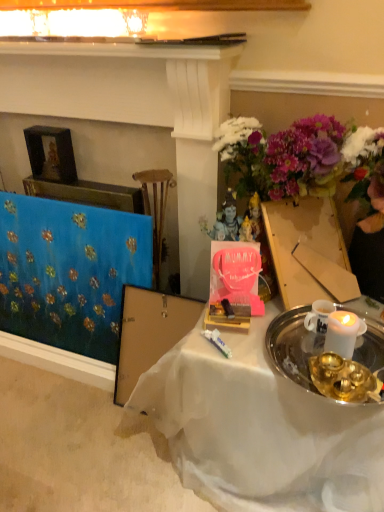
Question: Is blue fabric at left in front of or behind white sheer cloth at center in the image?

Choices:
 (A) behind
 (B) front

Answer: (A)

Question: Visually, is blue fabric at left positioned to the left or to the right of white sheer cloth at center?

Choices:
 (A) right
 (B) left

Answer: (B)

Question: Which of these objects is positioned closest to the blue fabric at left?

Choices:
 (A) white sheer cloth at center
 (B) blue fabric at left

Answer: (B)

Question: Considering the real-world distances, which object is closest to the white sheer cloth at center?

Choices:
 (A) blue fabric at left
 (B) blue fabric at left

Answer: (A)